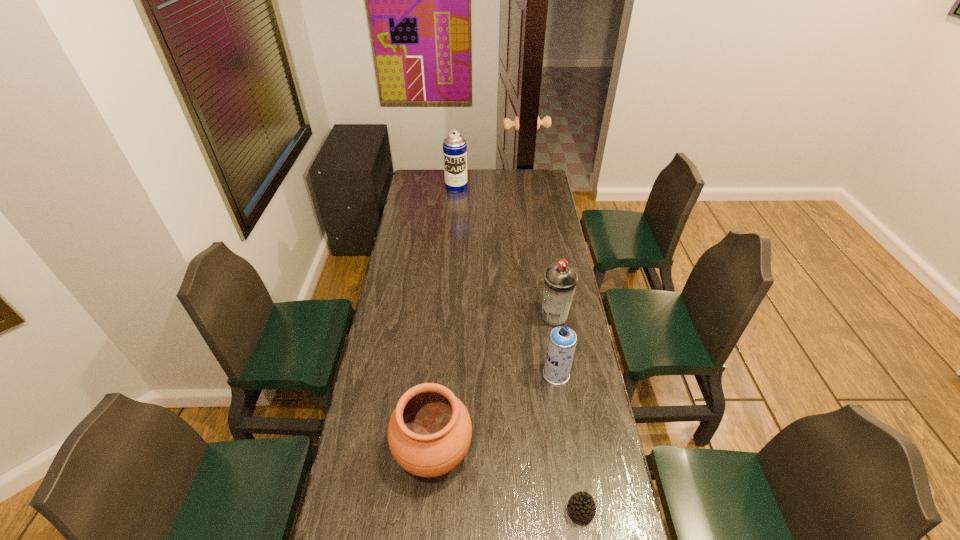
You are a GUI agent. You are given a task and a screenshot of the screen. Output one action in this format:
    pyautogui.click(x=<x>, y=<y>)
    Task: Click on the vacant area between the second nearest object and the second farthest aerosol can
    This screenshot has width=960, height=540.
    Given the screenshot: What is the action you would take?
    pyautogui.click(x=493, y=384)

Locate an element on the screen. The image size is (960, 540). vacant point located between the shortest object and the pottery is located at coordinates (507, 481).

Locate an element on the screen. The image size is (960, 540). object that stands as the second closest to the pottery is located at coordinates (562, 341).

Locate which object ranks in proximity to the farthest object. Please provide its 2D coordinates. Your answer should be formatted as a tuple, i.e. [(x, y)], where the tuple contains the x and y coordinates of a point satisfying the conditions above.

[(560, 281)]

What are the coordinates of `aerosol can that can be found as the closest to the third farthest object` in the screenshot? It's located at (560, 281).

Locate which aerosol can ranks second in proximity to the third farthest object. Please provide its 2D coordinates. Your answer should be formatted as a tuple, i.e. [(x, y)], where the tuple contains the x and y coordinates of a point satisfying the conditions above.

[(454, 145)]

The width and height of the screenshot is (960, 540). Find the location of `vacant space that satisfies the following two spatial constraints: 1. on the label side of the third nearest object; 2. on the right side of the farthest aerosol can`. vacant space that satisfies the following two spatial constraints: 1. on the label side of the third nearest object; 2. on the right side of the farthest aerosol can is located at coordinates (443, 374).

Find the location of `vacant area that satisfies the following two spatial constraints: 1. on the label side of the leftmost aerosol can; 2. on the left side of the second farthest object`. vacant area that satisfies the following two spatial constraints: 1. on the label side of the leftmost aerosol can; 2. on the left side of the second farthest object is located at coordinates (446, 317).

At what (x,y) coordinates should I click in order to perform the action: click on vacant position in the image that satisfies the following two spatial constraints: 1. on the label side of the leftmost aerosol can; 2. on the left side of the fourth shortest object. Please return your answer as a coordinate pair (x, y). This screenshot has width=960, height=540. Looking at the image, I should click on (446, 317).

The height and width of the screenshot is (540, 960). Identify the location of free space that satisfies the following two spatial constraints: 1. on the label side of the farthest aerosol can; 2. on the left side of the second shortest aerosol can. (446, 317).